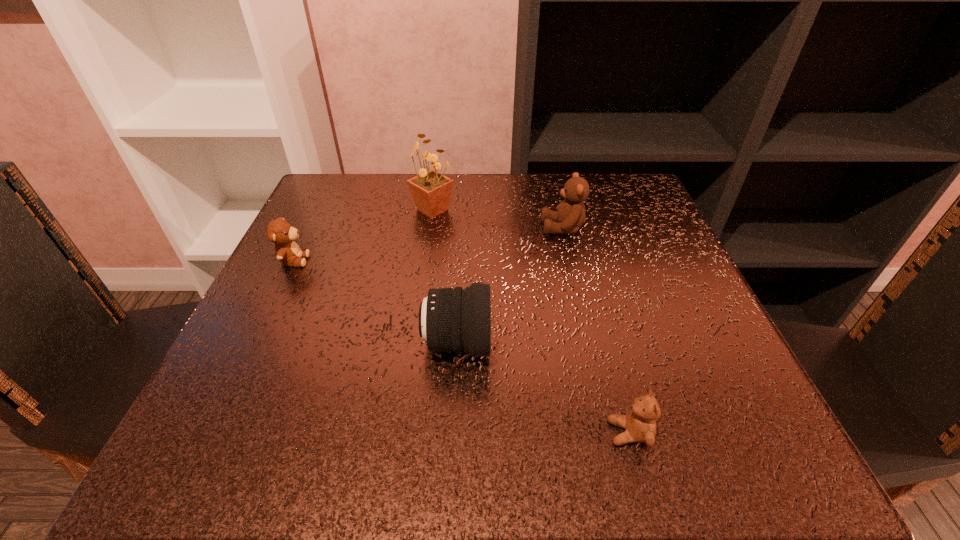
At what (x,y) coordinates should I click in order to perform the action: click on vacant space situated at the front element of the fourth farthest object. Please return your answer as a coordinate pair (x, y). The height and width of the screenshot is (540, 960). Looking at the image, I should click on (628, 343).

Identify the location of free space located 0.190m on the face of the leftmost object. (407, 260).

Where is `vacant space situated 0.200m on the face of the nearest object`? Image resolution: width=960 pixels, height=540 pixels. vacant space situated 0.200m on the face of the nearest object is located at coordinates (459, 433).

Image resolution: width=960 pixels, height=540 pixels. In order to click on free space located on the face of the nearest object in this screenshot , I will do `click(376, 433)`.

I want to click on vacant space located 0.240m on the face of the nearest object, so click(x=429, y=433).

Identify the location of sunflower located in the far edge section of the desktop. The image size is (960, 540). (431, 191).

Find the location of a particular element. This screenshot has width=960, height=540. teddy bear that is at the far edge is located at coordinates (570, 215).

Locate an element on the screen. object situated at the near edge is located at coordinates (640, 424).

The width and height of the screenshot is (960, 540). Identify the location of object present at the left edge. (279, 231).

Find the location of a particular element. This screenshot has height=540, width=960. object that is at the right edge is located at coordinates (640, 424).